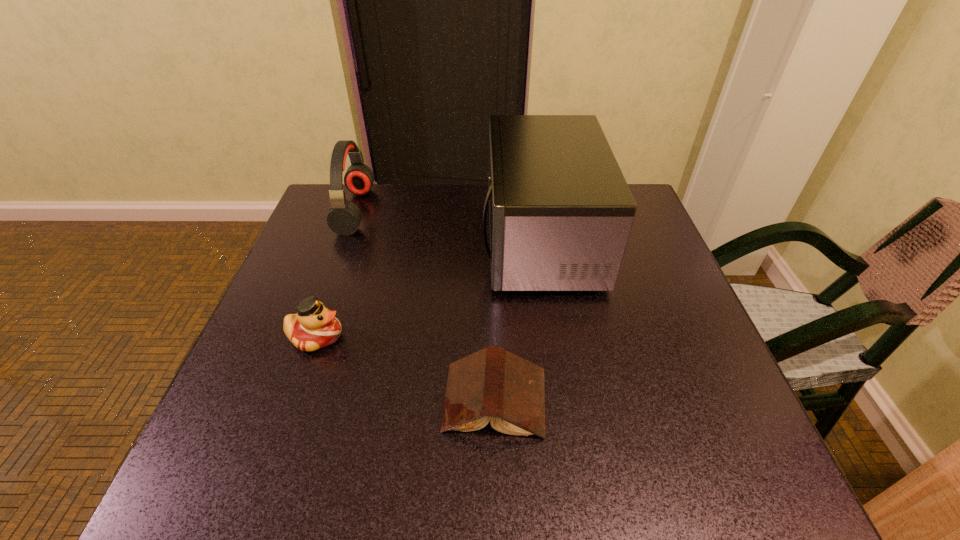
What are the coordinates of `vacant region that satisfies the following two spatial constraints: 1. on the back side of the shortest object; 2. on the ear cups of the earphone` in the screenshot? It's located at (490, 211).